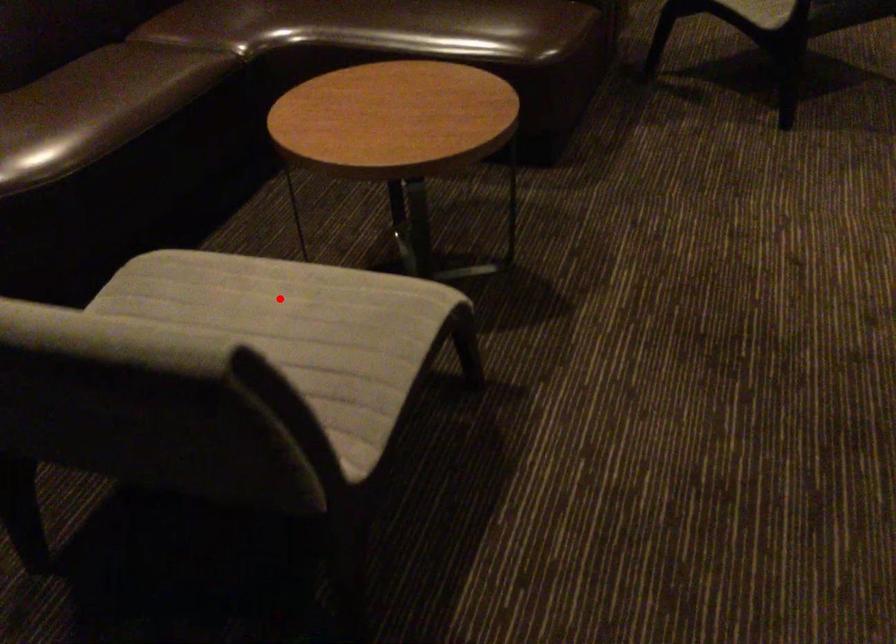
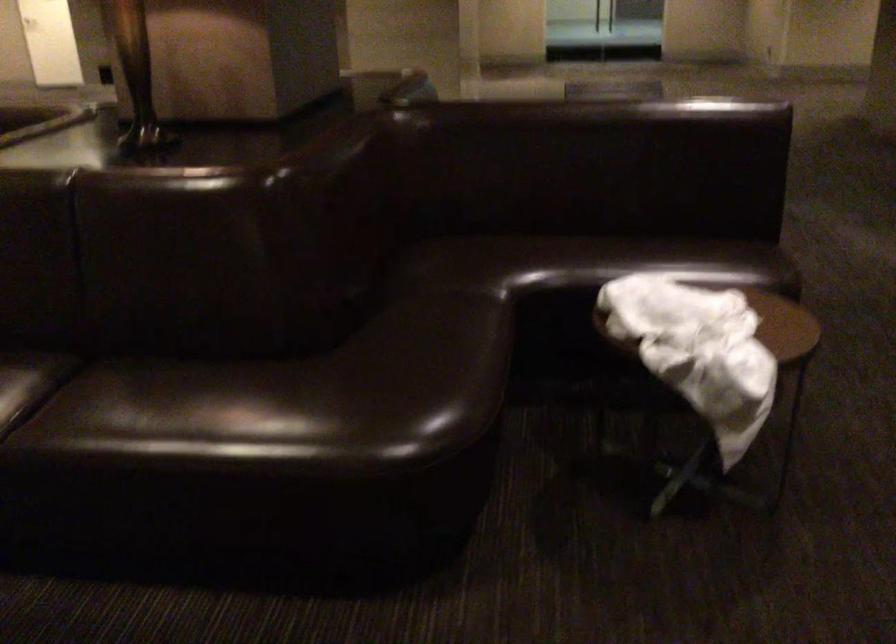
Question: I am providing you with two images of the same scene from different viewpoints. A red point is marked on the first image. Is the red point's position out of view in image 2?

Choices:
 (A) Yes
 (B) No

Answer: (A)